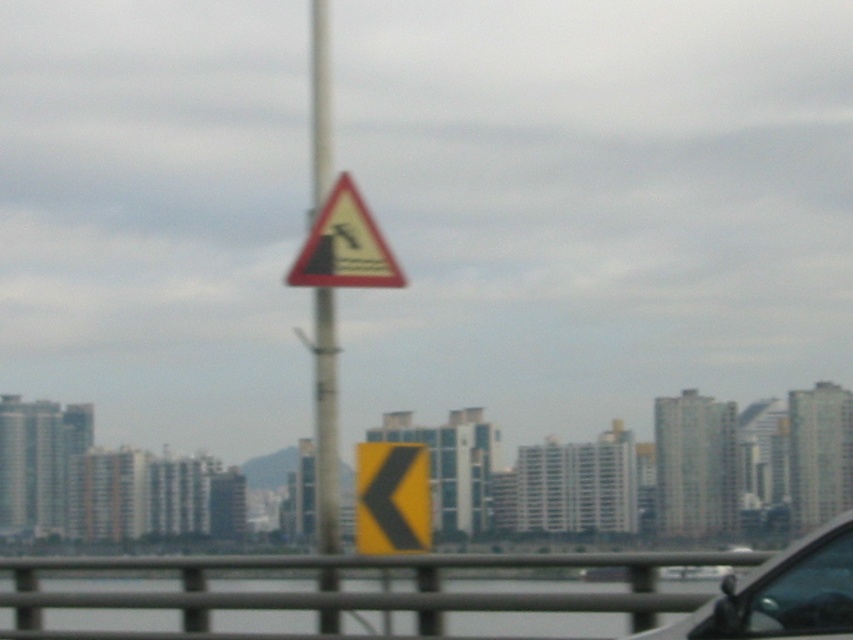
You are a driver approaching the yellow triangular warning sign at center and the metallic gray car at lower right. Which object appears larger in the image?

The yellow triangular warning sign at center appears larger than the metallic gray car at lower right.

You are standing on the bridge looking at the city skyline. There are two points marked in the image. Which point, point [831,566] or point [368,285], is closer to you?

Point [831,566] is closer to the viewer than point [368,285].

You are a driver approaching the bridge and see the yellow matte arrow at center and the yellow triangular warning sign at center. Which one is shorter in height?

The yellow matte arrow at center is not as tall as the yellow triangular warning sign at center, so the yellow matte arrow at center is shorter.